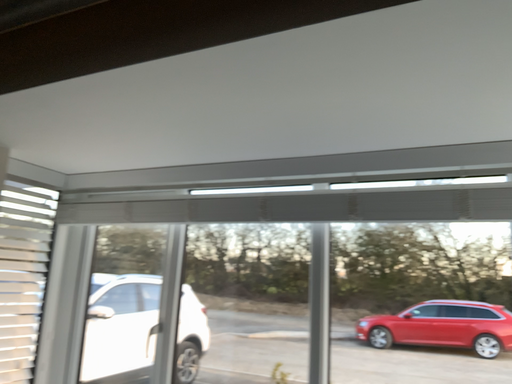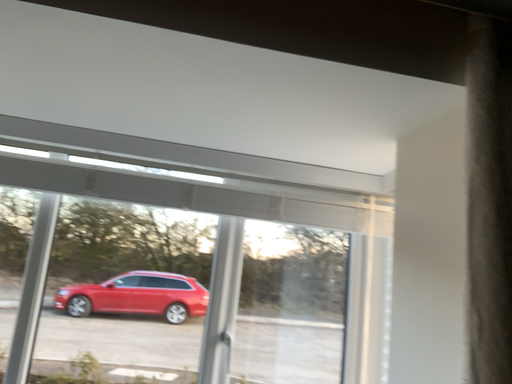
Question: Which way did the camera rotate in the video?

Choices:
 (A) rotated left
 (B) rotated right

Answer: (B)